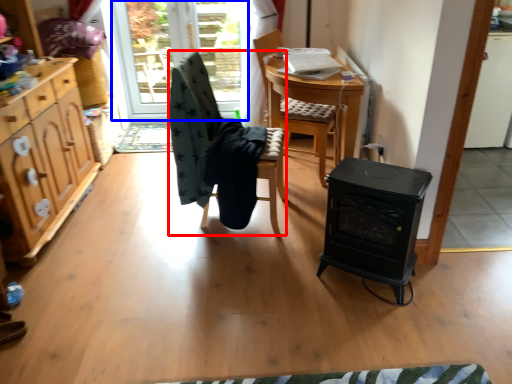
Question: Which object is further to the camera taking this photo, chair (highlighted by a red box) or window screen (highlighted by a blue box)?

Choices:
 (A) chair
 (B) window screen

Answer: (B)